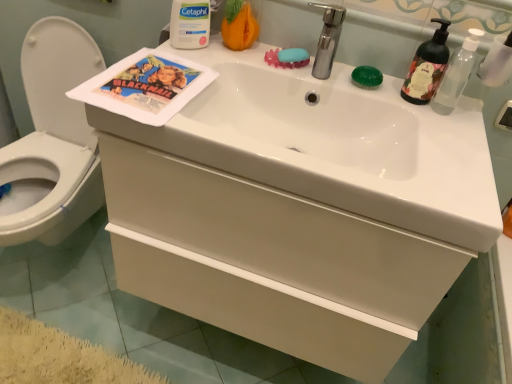
The image size is (512, 384). I want to click on vacant space to the right of blue matte soap at upper center, the first soap positioned from the left, so click(339, 66).